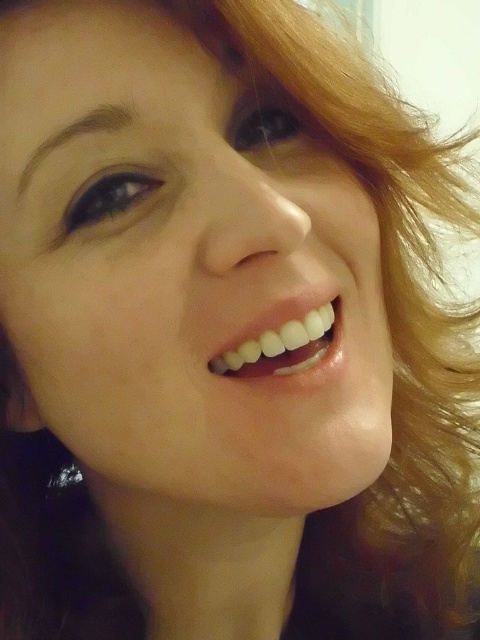
Between smooth skin face at center and white glossy teeth at center, which one has less height?

With less height is white glossy teeth at center.

Does smooth skin face at center appear on the right side of white glossy teeth at center?

In fact, smooth skin face at center is to the left of white glossy teeth at center.

Image resolution: width=480 pixels, height=640 pixels. Describe the element at coordinates (181, 266) in the screenshot. I see `smooth skin face at center` at that location.

Where is `smooth skin face at center`? smooth skin face at center is located at coordinates (181, 266).